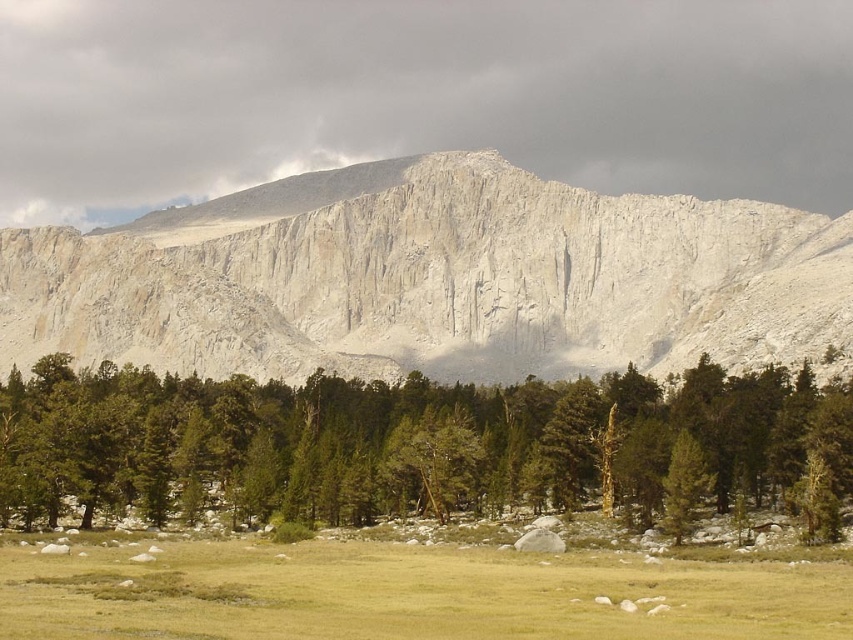
Is the position of white rock mountain at center more distant than that of green textured pine trees at lower center?

Yes, white rock mountain at center is further from the viewer.

Who is positioned more to the left, white rock mountain at center or green textured pine trees at lower center?

Positioned to the left is green textured pine trees at lower center.

Does point (450, 172) come in front of point (321, 412)?

No.

At what (x,y) coordinates should I click in order to perform the action: click on white rock mountain at center. Please return your answer as a coordinate pair (x, y). Looking at the image, I should click on (432, 280).